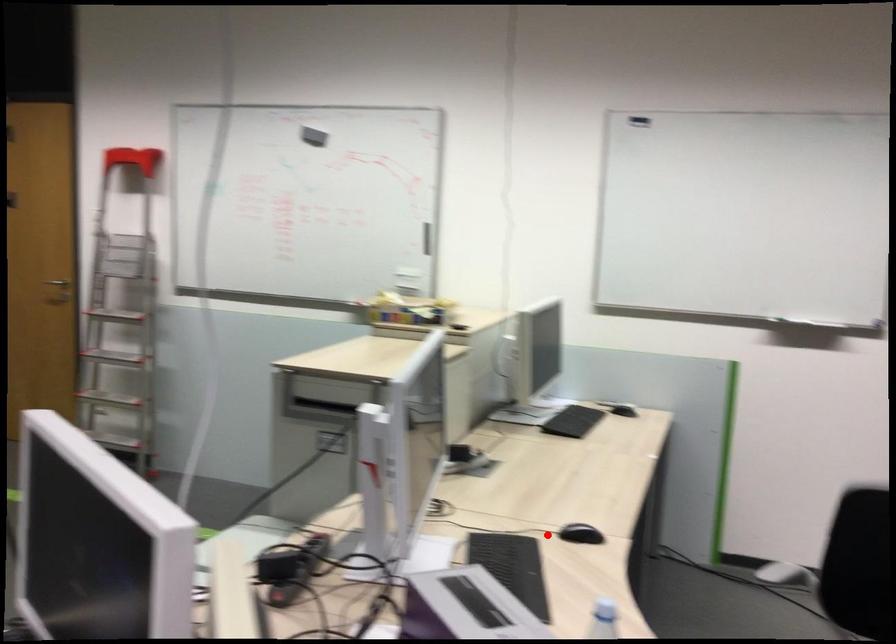
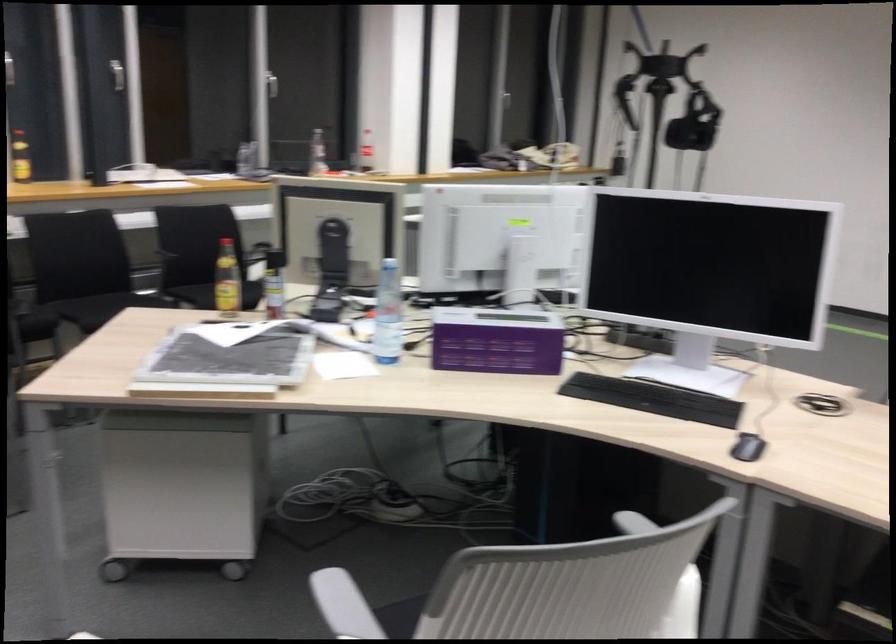
Where in the second image is the point corresponding to the highlighted location from the first image?

(747, 447)